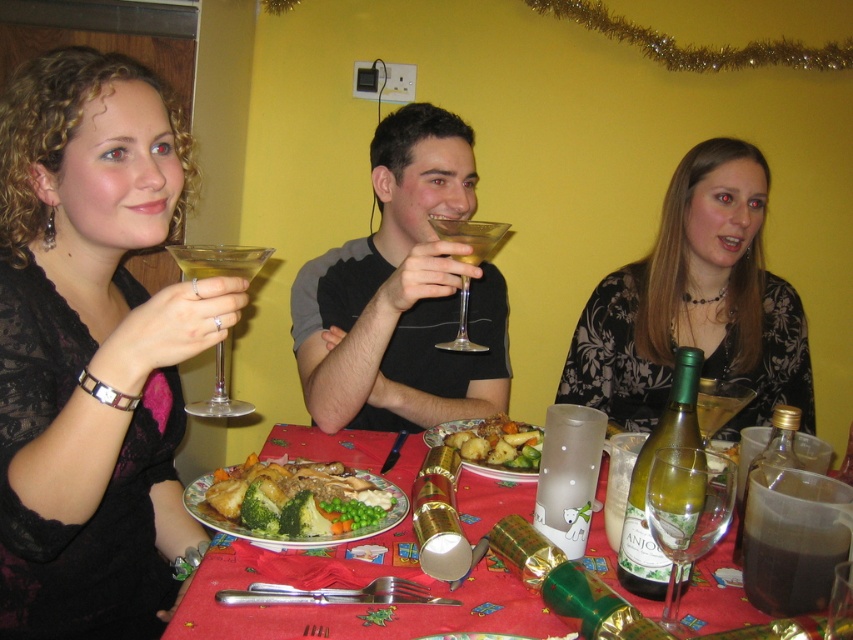
You are a guest at the Christmas dinner and want to place your phone between the black floral dress at center and the golden brown roasted potatoes at center on the table. Can you fit your phone there?

The black floral dress at center is wider than the golden brown roasted potatoes at center, so there might not be enough space to fit your phone between them.

You are a guest at the Christmas dinner and want to know which item is taller between the golden brown roasted chicken at center and the gold metallic cracker at center. Can you tell me which one is taller?

The gold metallic cracker at center is taller than the golden brown roasted chicken at center.

You are standing at the point labeled as point (221, 497). If you want to reach the power outlet on the yellow wall, which is 35.72 inches away from you, can you walk straight towards it without any obstacles?

The distance between point (221, 497) and the viewer is 35.72 inches. Since there are no mentioned obstacles in the scene description, you can walk straight towards the power outlet on the yellow wall.